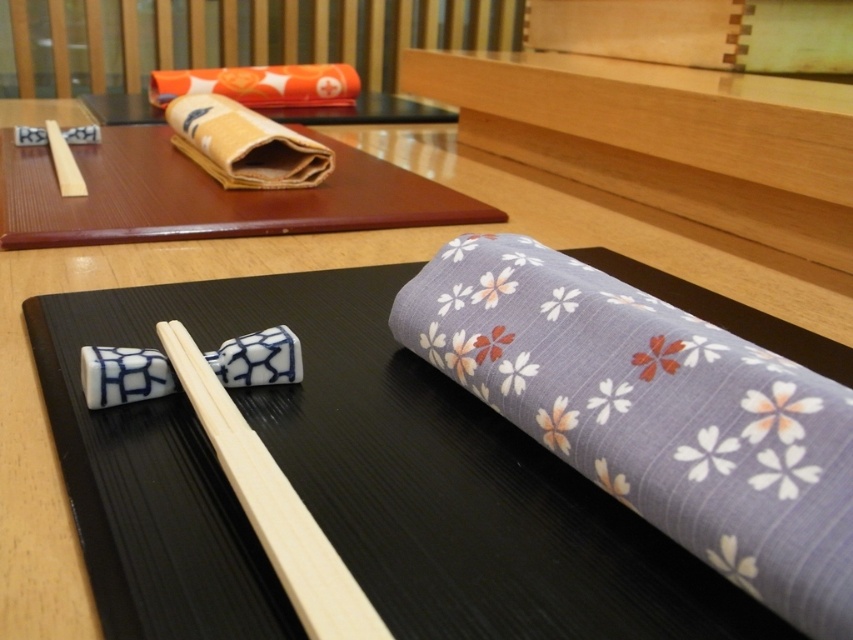
Is porcelain/patterned cube at center taller than wooden chopsticks at upper left?

No, porcelain/patterned cube at center is not taller than wooden chopsticks at upper left.

Is point (227, 365) in front of point (51, 122)?

Yes.

I want to click on porcelain/patterned cube at center, so [258, 358].

Is satin floral napkin at center above porcelain/patterned cube at center?

Actually, satin floral napkin at center is below porcelain/patterned cube at center.

Who is more distant from viewer, (515, 298) or (285, 330)?

Positioned behind is point (285, 330).

Which is in front, point (567, 420) or point (241, 372)?

Point (567, 420) is more forward.

At what (x,y) coordinates should I click in order to perform the action: click on satin floral napkin at center. Please return your answer as a coordinate pair (x, y). The image size is (853, 640). Looking at the image, I should click on (654, 413).

Can you confirm if porcelain/patterned chopstick rest at center is positioned below wooden chopsticks at upper left?

Indeed, porcelain/patterned chopstick rest at center is positioned under wooden chopsticks at upper left.

Consider the image. Does porcelain/patterned chopstick rest at center lie in front of wooden chopsticks at upper left?

Yes, porcelain/patterned chopstick rest at center is in front of wooden chopsticks at upper left.

Is point (131, 374) positioned in front of point (55, 122)?

That is True.

Identify the location of porcelain/patterned chopstick rest at center. The image size is (853, 640). (123, 376).